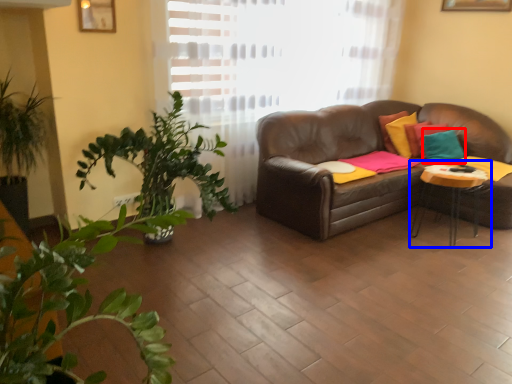
Question: Among these objects, which one is farthest to the camera, pillow (highlighted by a red box) or table (highlighted by a blue box)?

Choices:
 (A) pillow
 (B) table

Answer: (A)